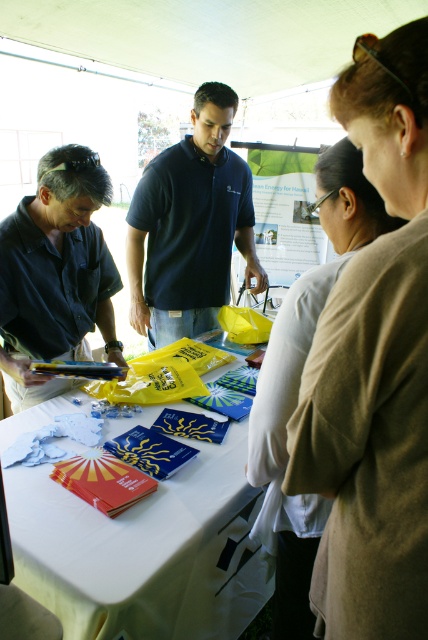
Question: Estimate the real-world distances between objects in this image. Which object is closer to the matte black shirt at left?

Choices:
 (A) light beige sweater at center
 (B) dark blue polo shirt at center

Answer: (B)

Question: Where is matte black shirt at left located in relation to light beige sweater at center in the image?

Choices:
 (A) above
 (B) below

Answer: (A)

Question: Does white cloth table at center have a larger size compared to matte black shirt at left?

Choices:
 (A) yes
 (B) no

Answer: (A)

Question: Observing the image, what is the correct spatial positioning of white cloth table at center in reference to matte black shirt at left?

Choices:
 (A) above
 (B) below

Answer: (B)

Question: Which object is positioned closest to the white cloth table at center?

Choices:
 (A) dark blue polo shirt at center
 (B) matte black shirt at left
 (C) light beige sweater at center

Answer: (C)

Question: Which of the following is the closest to the observer?

Choices:
 (A) white cloth table at center
 (B) matte black shirt at left

Answer: (A)